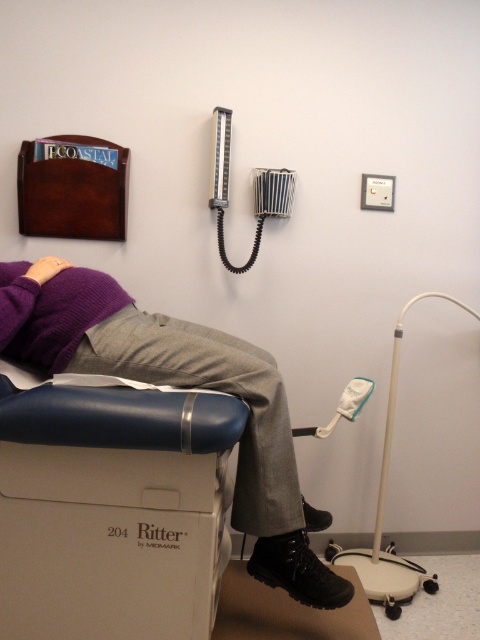
Is white plastic floor lamp at lower right behind black leather boot at lower center?

Yes, white plastic floor lamp at lower right is behind black leather boot at lower center.

Consider the image. Does white plastic floor lamp at lower right have a larger size compared to black leather boot at lower center?

Yes, white plastic floor lamp at lower right is bigger than black leather boot at lower center.

You are a GUI agent. You are given a task and a screenshot of the screen. Output one action in this format:
    pyautogui.click(x=<x>, y=<y>)
    Task: Click on the white plastic floor lamp at lower right
    
    Given the screenshot: What is the action you would take?
    pyautogui.click(x=383, y=515)

This screenshot has height=640, width=480. Identify the location of white plastic floor lamp at lower right. (383, 515).

Based on the photo, does purple sweater at upper left appear on the right side of white plastic floor lamp at lower right?

In fact, purple sweater at upper left is to the left of white plastic floor lamp at lower right.

Which is more to the left, purple sweater at upper left or white plastic floor lamp at lower right?

purple sweater at upper left is more to the left.

Who is more distant from viewer, [27,349] or [392,564]?

The point [392,564] is more distant.

I want to click on purple sweater at upper left, so click(180, 387).

Between purple sweater at upper left and striped fabric blood pressure cuff at upper center, which one has less height?

Answer: striped fabric blood pressure cuff at upper center

Which is in front, point (183, 356) or point (211, 196)?

Point (183, 356) is in front.

Describe the element at coordinates (180, 387) in the screenshot. This screenshot has height=640, width=480. I see `purple sweater at upper left` at that location.

Where is `purple sweater at upper left`? The width and height of the screenshot is (480, 640). purple sweater at upper left is located at coordinates (180, 387).